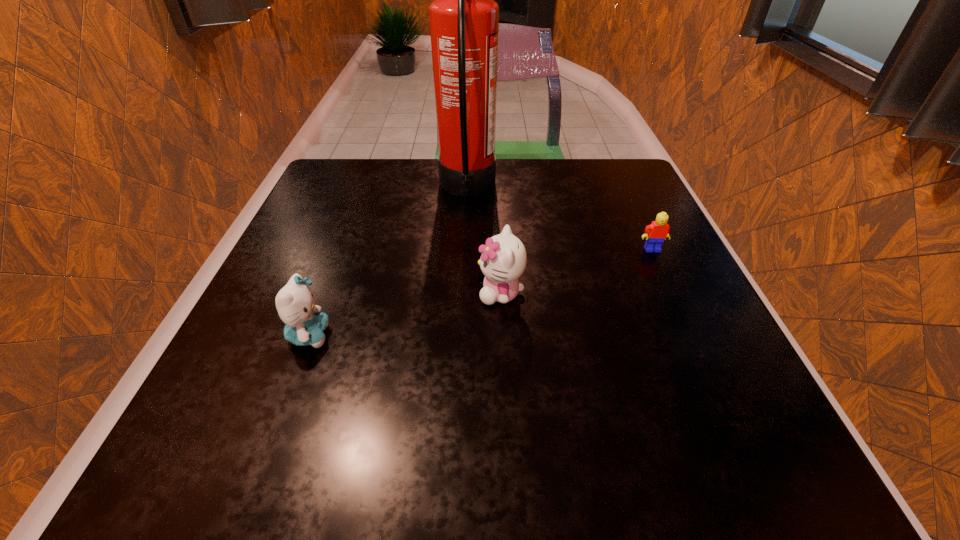
You are a GUI agent. You are given a task and a screenshot of the screen. Output one action in this format:
    pyautogui.click(x=<x>, y=<y>)
    Task: Click on the free location at the right edge
    This screenshot has height=540, width=960.
    Given the screenshot: What is the action you would take?
    pyautogui.click(x=593, y=233)

Image resolution: width=960 pixels, height=540 pixels. Identify the location of vacant region at the far left corner of the desktop. (342, 165).

Locate an element on the screen. vacant region at the far right corner of the desktop is located at coordinates (594, 168).

Where is `vacant region at the near right corner of the desktop`? The height and width of the screenshot is (540, 960). vacant region at the near right corner of the desktop is located at coordinates (674, 424).

Identify the location of free space between the farther kitten and the left kitten. This screenshot has width=960, height=540. (405, 314).

This screenshot has width=960, height=540. I want to click on free space between the fire extinguisher and the third farthest object, so click(x=484, y=240).

Where is `free area in between the rightmost object and the right kitten`? The image size is (960, 540). free area in between the rightmost object and the right kitten is located at coordinates (577, 271).

At what (x,y) coordinates should I click in order to perform the action: click on vacant space that is in between the shorter kitten and the farthest object. Please return your answer as a coordinate pair (x, y). This screenshot has height=540, width=960. Looking at the image, I should click on (388, 262).

You are a GUI agent. You are given a task and a screenshot of the screen. Output one action in this format:
    pyautogui.click(x=<x>, y=<y>)
    Task: Click on the empty space between the shorter kitten and the farthest object
    
    Given the screenshot: What is the action you would take?
    pyautogui.click(x=388, y=262)

Find the location of `free space that is in between the third farthest object and the Lego`. free space that is in between the third farthest object and the Lego is located at coordinates (577, 271).